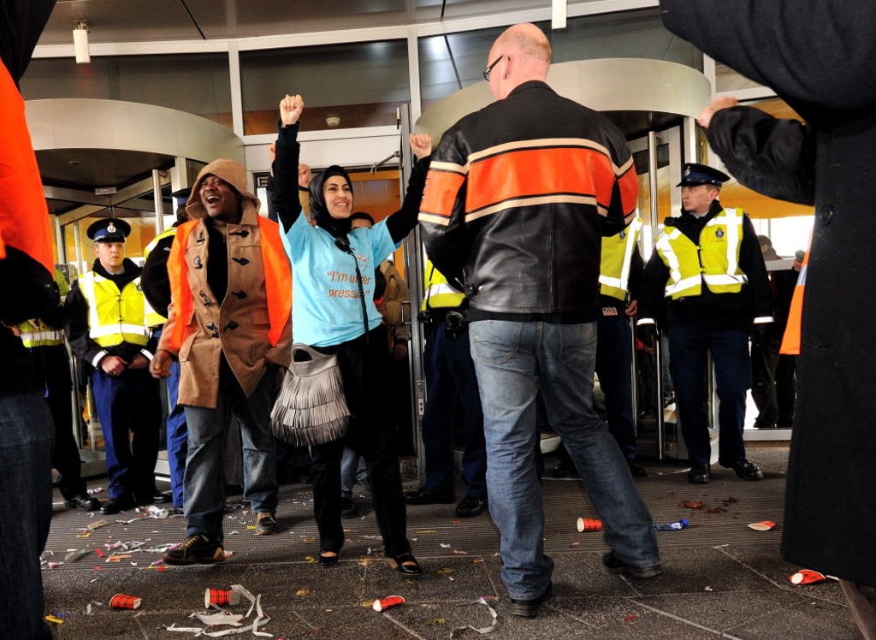
You are standing at the point marked as point (510, 243) and want to approach the revolving door to exit. Considering the distance between you and the revolving door, can you safely walk straight ahead without needing to adjust your path?

The distance between you and the revolving door is 2.75 meters, so you can safely walk straight ahead without needing to adjust your path since the distance is manageable.